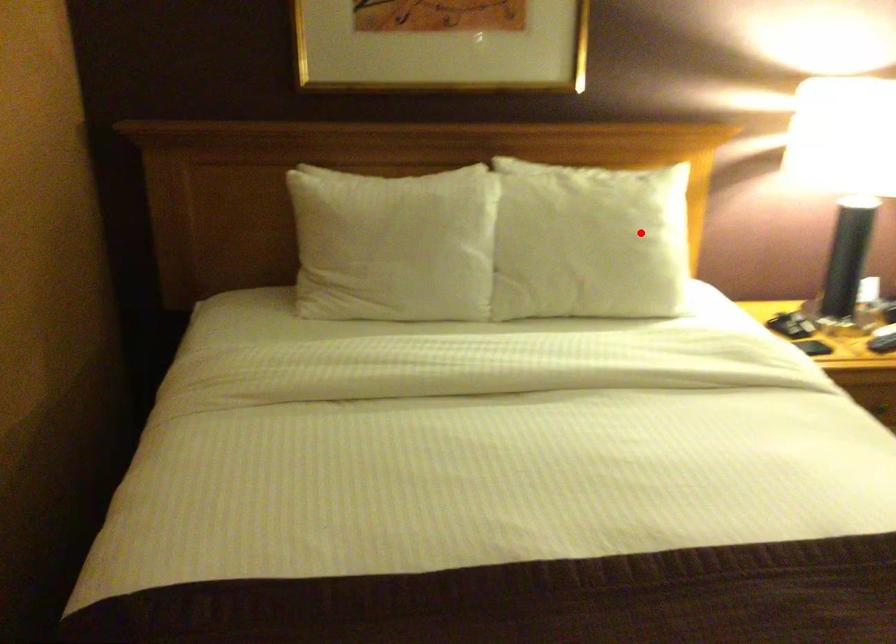
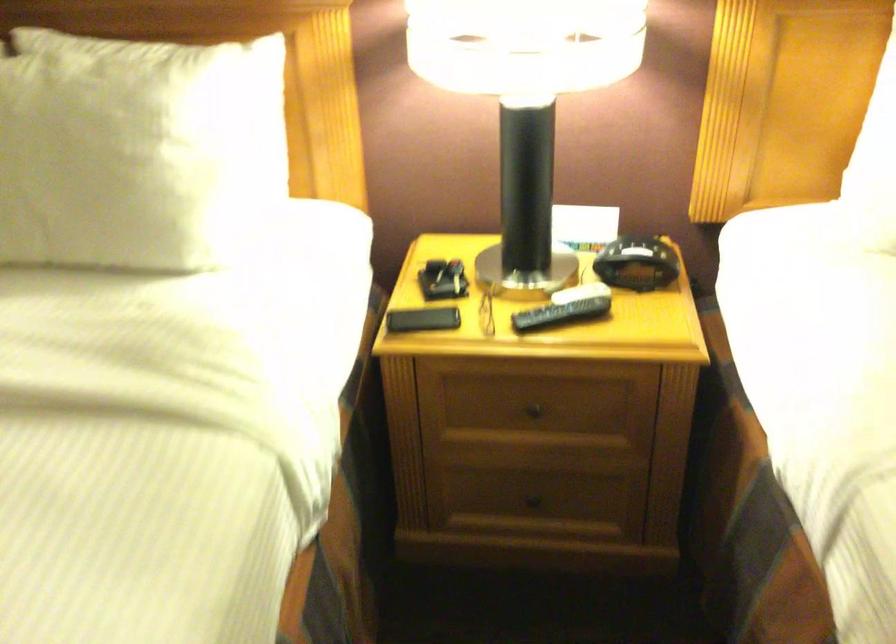
Question: I am providing you with two images of the same scene from different viewpoints. In image1, a red point is highlighted. Considering the same 3D point in image2, which of the following is correct?

Choices:
 (A) It is closer
 (B) It is farther

Answer: (A)